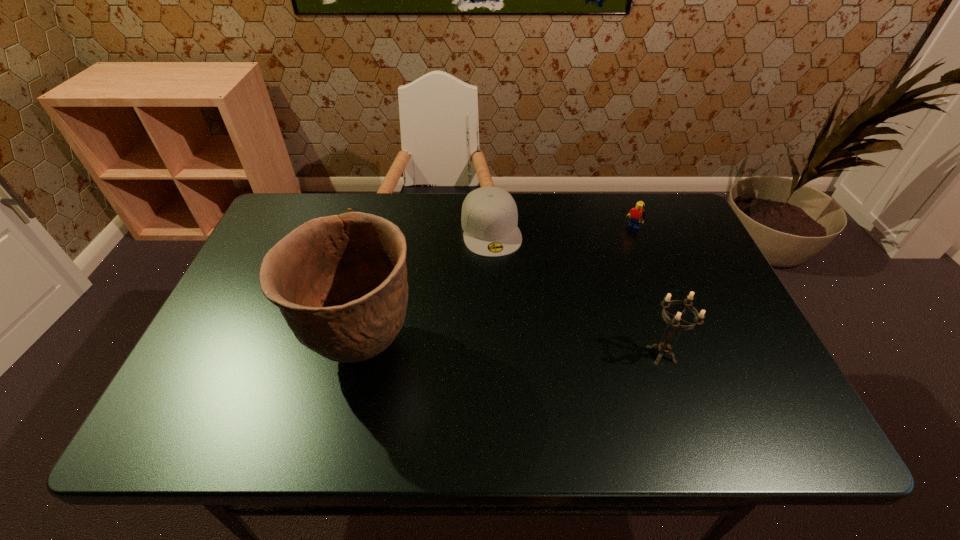
Find the location of `free spot that satisfies the following two spatial constraints: 1. on the back side of the cap; 2. on the left side of the pottery`. free spot that satisfies the following two spatial constraints: 1. on the back side of the cap; 2. on the left side of the pottery is located at coordinates (389, 229).

This screenshot has width=960, height=540. In order to click on blank area in the image that satisfies the following two spatial constraints: 1. on the front side of the cap; 2. on the right side of the fourth shortest object in this screenshot , I will do `click(494, 354)`.